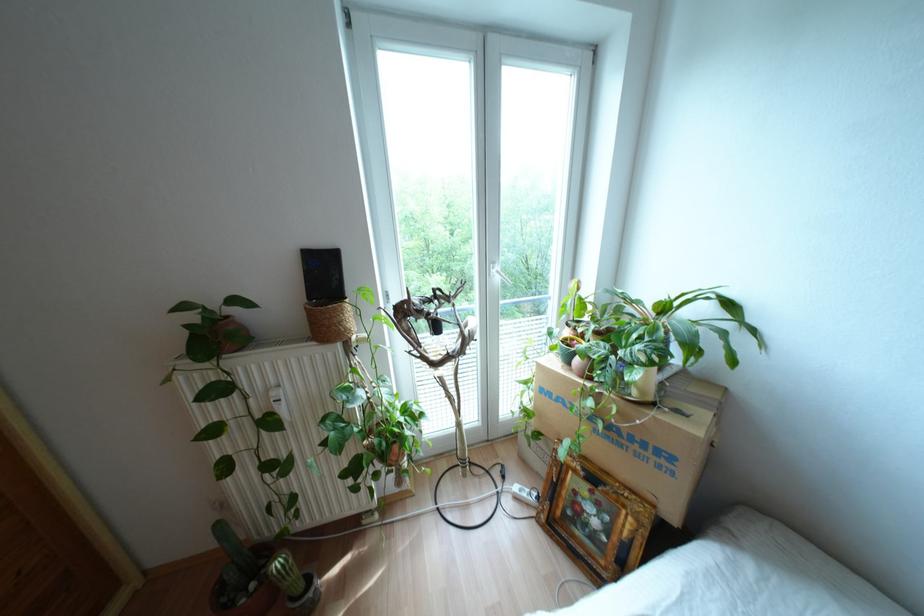
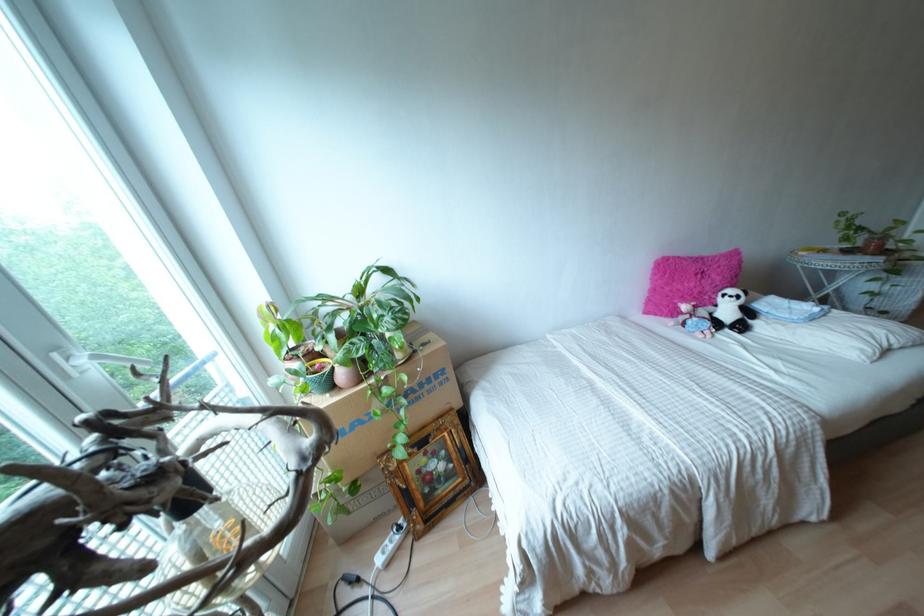
Where in the second image is the point corresponding to (x=578, y=499) from the first image?

(423, 469)